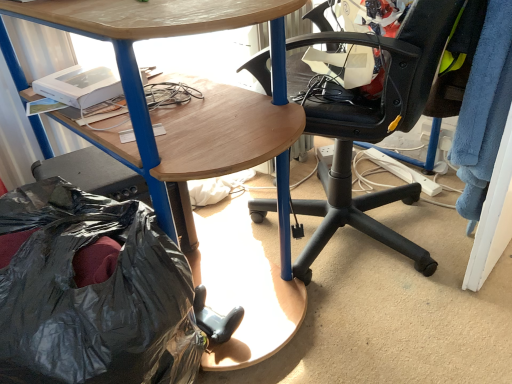
Question: From the image's perspective, is wooden desk at center under black plastic chair at center?

Choices:
 (A) no
 (B) yes

Answer: (A)

Question: Could black plastic chair at center be considered to be inside wooden desk at center?

Choices:
 (A) yes
 (B) no

Answer: (A)

Question: Does wooden desk at center have a greater width compared to black plastic chair at center?

Choices:
 (A) no
 (B) yes

Answer: (B)

Question: Is wooden desk at center located outside black plastic chair at center?

Choices:
 (A) yes
 (B) no

Answer: (A)

Question: Does wooden desk at center have a smaller size compared to black plastic chair at center?

Choices:
 (A) no
 (B) yes

Answer: (A)

Question: Does wooden desk at center lie behind black plastic chair at center?

Choices:
 (A) no
 (B) yes

Answer: (A)

Question: Is black plastic chair at center to the right of wooden desk at center from the viewer's perspective?

Choices:
 (A) yes
 (B) no

Answer: (A)

Question: Can you confirm if black plastic chair at center is wider than wooden desk at center?

Choices:
 (A) no
 (B) yes

Answer: (A)

Question: Can you confirm if black plastic chair at center is smaller than wooden desk at center?

Choices:
 (A) yes
 (B) no

Answer: (A)

Question: Is black plastic chair at center further to the viewer compared to wooden desk at center?

Choices:
 (A) no
 (B) yes

Answer: (B)

Question: Is black plastic chair at center shorter than wooden desk at center?

Choices:
 (A) no
 (B) yes

Answer: (B)

Question: Can wooden desk at center be found inside black plastic chair at center?

Choices:
 (A) no
 (B) yes

Answer: (B)

Question: Is wooden desk at center thinner than black plastic bag at lower left?

Choices:
 (A) yes
 (B) no

Answer: (B)